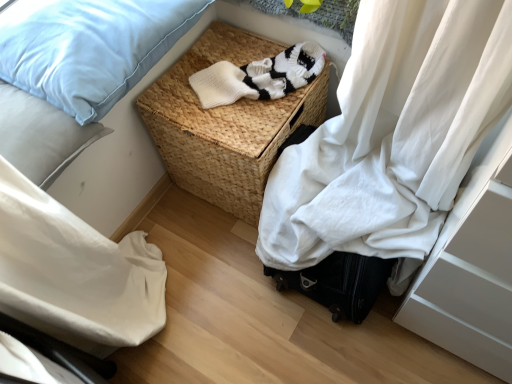
Question: Based on their positions, is light blue fabric pillow at upper left, acting as the 2th pillow starting from the bottom, located to the left or right of white knitted sweater at center?

Choices:
 (A) right
 (B) left

Answer: (B)

Question: Based on their sizes in the image, would you say light blue fabric pillow at upper left, the 1th pillow positioned from the top, is bigger or smaller than white knitted sweater at center?

Choices:
 (A) big
 (B) small

Answer: (A)

Question: Considering the real-world distances, which object is closest to the black hard suitcase at lower right?

Choices:
 (A) woven brown picnic basket at center
 (B) light blue fabric pillow at upper left, marked as the second pillow in a top-to-bottom arrangement
 (C) white knitted sweater at center
 (D) light blue fabric pillow at upper left, the 1th pillow positioned from the top

Answer: (A)

Question: Estimate the real-world distances between objects in this image. Which object is closer to the woven brown picnic basket at center?

Choices:
 (A) black hard suitcase at lower right
 (B) white knitted sweater at center
 (C) light blue fabric pillow at upper left, which is the first pillow from bottom to top
 (D) light blue fabric pillow at upper left, acting as the 2th pillow starting from the bottom

Answer: (B)